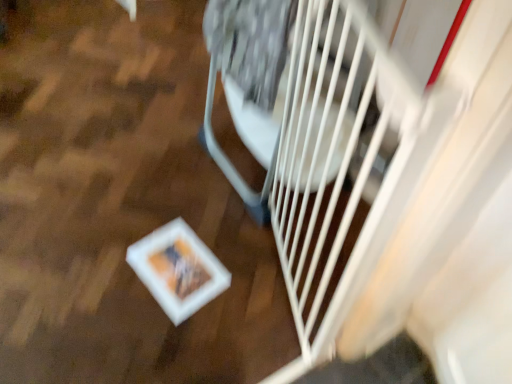
Measure the distance between white plastic gate at right and camera.

32.81 inches.

Find the location of a particular element. white plastic gate at right is located at coordinates (250, 75).

This screenshot has height=384, width=512. Describe the element at coordinates (250, 75) in the screenshot. I see `white plastic gate at right` at that location.

The image size is (512, 384). What are the coordinates of `white matte gate at center` in the screenshot? It's located at (120, 204).

What do you see at coordinates (120, 204) in the screenshot? I see `white matte gate at center` at bounding box center [120, 204].

Find the location of a particular element. This screenshot has width=512, height=384. white plastic gate at right is located at coordinates (250, 75).

Based on the photo, which is more to the right, white matte gate at center or white plastic gate at right?

white plastic gate at right is more to the right.

Which object is closer to the camera taking this photo, white matte gate at center or white plastic gate at right?

white plastic gate at right.

Between point (185, 201) and point (211, 128), which one is positioned in front?

The point (185, 201) is closer.

From the image's perspective, which object appears higher, white matte gate at center or white plastic gate at right?

white matte gate at center appears higher in the image.

From a real-world perspective, is white matte gate at center on white plastic gate at right?

No.

Looking at their sizes, would you say white matte gate at center is wider or thinner than white plastic gate at right?

Clearly, white matte gate at center has more width compared to white plastic gate at right.

Considering the sizes of white matte gate at center and white plastic gate at right in the image, is white matte gate at center taller or shorter than white plastic gate at right?

Clearly, white matte gate at center is shorter compared to white plastic gate at right.

Considering the sizes of white matte gate at center and white plastic gate at right in the image, is white matte gate at center bigger or smaller than white plastic gate at right?

white matte gate at center is smaller than white plastic gate at right.

Is white plastic gate at right completely or partially inside white matte gate at center?

No, white plastic gate at right is not surrounded by white matte gate at center.

Is white matte gate at center in contact with white plastic gate at right?

No.

Is white plastic gate at right at the back of white matte gate at center?

white matte gate at center does not have its back to white plastic gate at right.

How far apart are white matte gate at center and white plastic gate at right?

white matte gate at center is 15.29 inches from white plastic gate at right.

At what (x,y) coordinates should I click in order to perform the action: click on wide located above the white matte gate at center (from a real-world perspective). Please return your answer as a coordinate pair (x, y). The height and width of the screenshot is (384, 512). Looking at the image, I should click on (250, 75).

Considering the relative positions of white plastic gate at right and white matte gate at center in the image provided, is white plastic gate at right to the left or to the right of white matte gate at center?

In the image, white plastic gate at right appears on the right side of white matte gate at center.

Does white plastic gate at right lie in front of white matte gate at center?

Yes.

Considering the positions of points (246, 83) and (34, 93), is point (246, 83) farther from camera compared to point (34, 93)?

No, (246, 83) is in front of (34, 93).

From the image's perspective, which is below, white plastic gate at right or white matte gate at center?

From the image's view, white plastic gate at right is below.

From a real-world perspective, who is located lower, white plastic gate at right or white matte gate at center?

From a 3D spatial view, white matte gate at center is below.

Between white plastic gate at right and white matte gate at center, which one has larger width?

white matte gate at center.

Between white plastic gate at right and white matte gate at center, which one has less height?

white matte gate at center is shorter.

Is white plastic gate at right smaller than white matte gate at center?

Actually, white plastic gate at right might be larger than white matte gate at center.

Choose the correct answer: Is white plastic gate at right inside white matte gate at center or outside it?

white plastic gate at right cannot be found inside white matte gate at center.

Are white plastic gate at right and white matte gate at center located far from each other?

No, there isn't a large distance between white plastic gate at right and white matte gate at center.

Is white plastic gate at right facing towards white matte gate at center?

No, white plastic gate at right is not oriented towards white matte gate at center.

Can you tell me how much white plastic gate at right and white matte gate at center differ in facing direction?

The facing directions of white plastic gate at right and white matte gate at center are 91.7 degrees apart.

Identify the location of wood behind the white plastic gate at right. This screenshot has height=384, width=512. (120, 204).

Find the location of a particular element. This screenshot has width=512, height=384. wood below the white plastic gate at right (from a real-world perspective) is located at coordinates (120, 204).

This screenshot has height=384, width=512. In order to click on wide located on the right of white matte gate at center in this screenshot , I will do `click(250, 75)`.